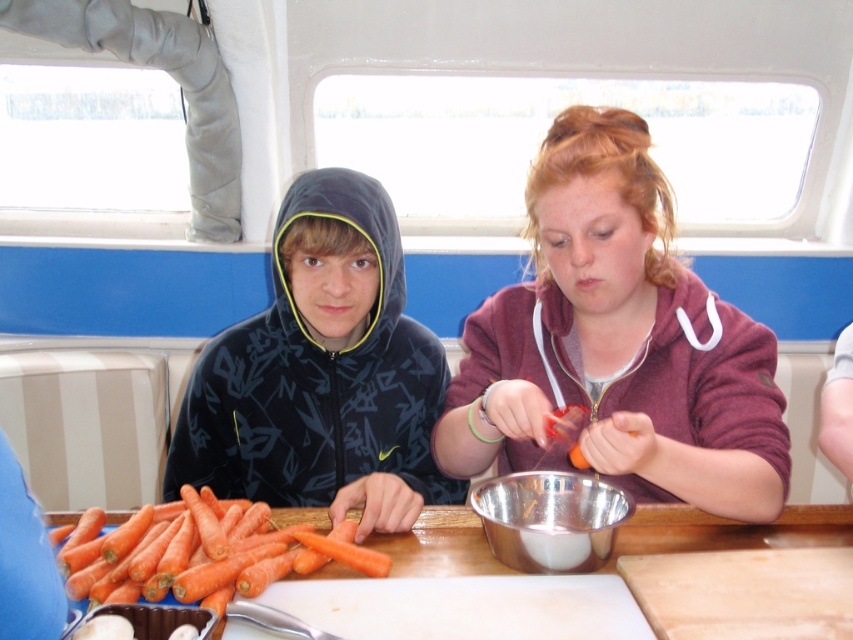
Question: Which is farther from the orange wood table at center?

Choices:
 (A) maroon fleece at center
 (B) silver metallic bowl at center

Answer: (A)

Question: Which is nearer to the orange matte carrots at lower left?

Choices:
 (A) maroon fleece at center
 (B) silver metallic bowl at center
 (C) matte black hoodie at center
 (D) orange wood table at center

Answer: (D)

Question: Can you confirm if orange wood table at center is positioned above silver metallic bowl at center?

Choices:
 (A) yes
 (B) no

Answer: (B)

Question: Based on their relative distances, which object is nearer to the orange matte carrots at lower left?

Choices:
 (A) silver metallic bowl at center
 (B) matte black hoodie at center

Answer: (B)

Question: Does orange wood table at center have a greater width compared to orange matte carrots at lower left?

Choices:
 (A) no
 (B) yes

Answer: (B)

Question: Can you confirm if matte black hoodie at center is bigger than silver metallic bowl at center?

Choices:
 (A) yes
 (B) no

Answer: (A)